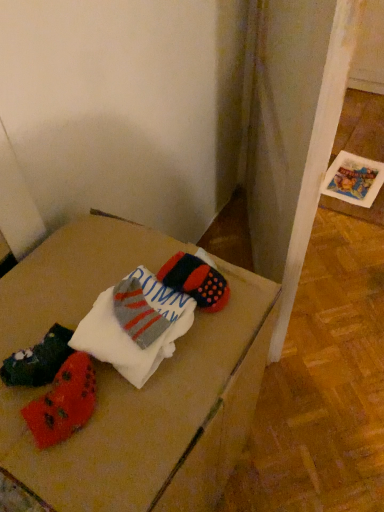
Identify the location of free space to the left of white cotton socks at center. (44, 311).